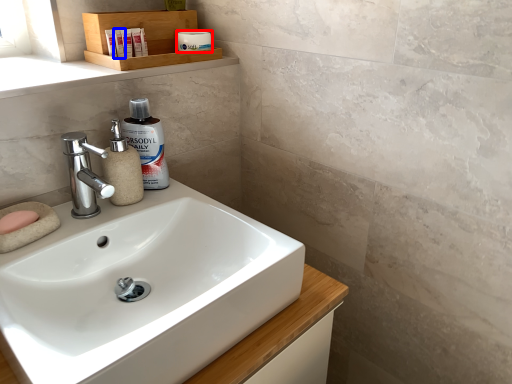
Question: Among these objects, which one is nearest to the camera, toiletry (highlighted by a red box) or toiletry (highlighted by a blue box)?

Choices:
 (A) toiletry
 (B) toiletry

Answer: (B)